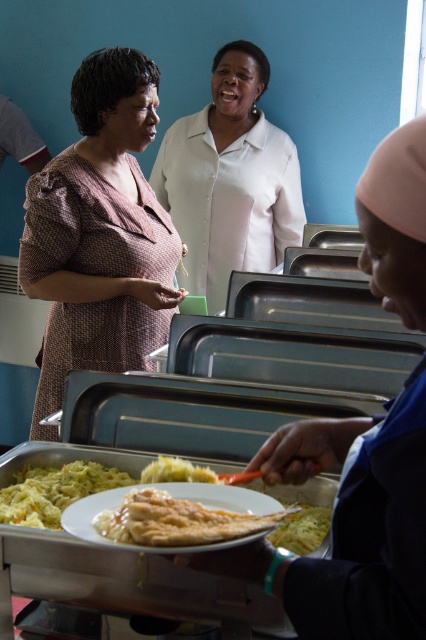
Is golden-brown crispy flatbread at center to the left of golden brown crispy chicken at center from the viewer's perspective?

Correct, you'll find golden-brown crispy flatbread at center to the left of golden brown crispy chicken at center.

Between golden-brown crispy flatbread at center and golden brown crispy chicken at center, which one is positioned higher?

Positioned higher is golden brown crispy chicken at center.

I want to click on golden-brown crispy flatbread at center, so click(x=77, y=486).

Which is more to the left, golden-brown crispy flatbread at center or yellowish matte rice at lower center?

From the viewer's perspective, yellowish matte rice at lower center appears more on the left side.

Between golden-brown crispy flatbread at center and yellowish matte rice at lower center, which one has more height?

golden-brown crispy flatbread at center

Is point (281, 525) positioned behind point (22, 497)?

No, (281, 525) is in front of (22, 497).

The height and width of the screenshot is (640, 426). I want to click on golden-brown crispy flatbread at center, so click(x=77, y=486).

Is golden-brown crispy flatbread at center further to camera compared to yellowish matte pasta at lower center?

Yes, golden-brown crispy flatbread at center is behind yellowish matte pasta at lower center.

Can you confirm if golden-brown crispy flatbread at center is wider than yellowish matte pasta at lower center?

Correct, the width of golden-brown crispy flatbread at center exceeds that of yellowish matte pasta at lower center.

Between point (328, 518) and point (308, 515), which one is positioned behind?

The point (308, 515) is more distant.

Find the location of a particular element. The image size is (426, 640). golden-brown crispy flatbread at center is located at coordinates [x=77, y=486].